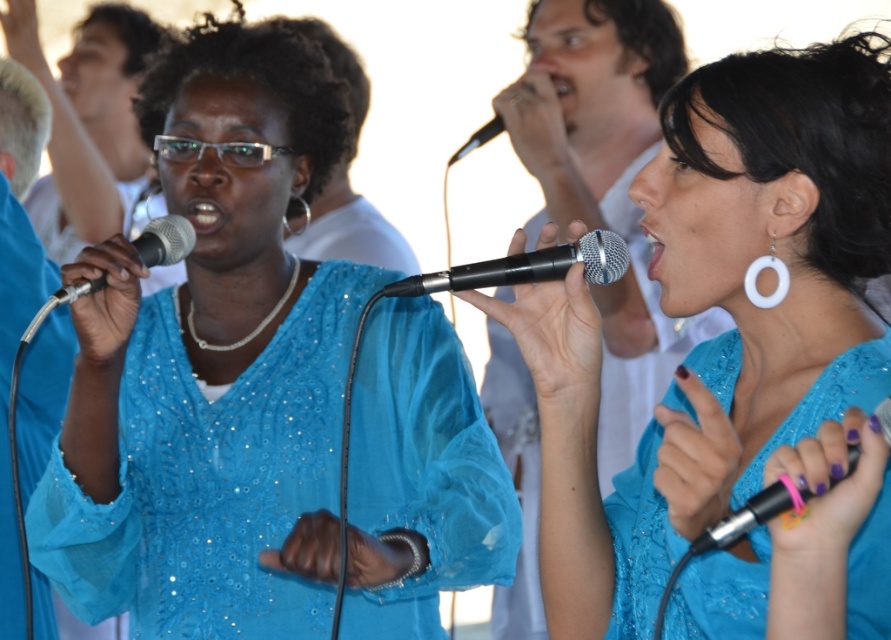
Question: Which object appears closest to the camera in this image?

Choices:
 (A) matte blue dress at center
 (B) black metallic microphone at center

Answer: (A)

Question: Does metallic silver microphone at center have a lesser width compared to metallic black microphone at upper center?

Choices:
 (A) no
 (B) yes

Answer: (B)

Question: Can you confirm if matte blue dress at center is positioned below matte black microphone at left?

Choices:
 (A) no
 (B) yes

Answer: (B)

Question: Among these points, which one is nearest to the camera?

Choices:
 (A) (160, 260)
 (B) (742, 536)
 (C) (512, 96)
 (D) (676, 385)

Answer: (B)

Question: Which point is closer to the camera?

Choices:
 (A) matte blue blouse at center
 (B) metallic silver microphone at center

Answer: (B)

Question: Is matte blue blouse at center closer to the viewer compared to metallic silver microphone at center?

Choices:
 (A) no
 (B) yes

Answer: (A)